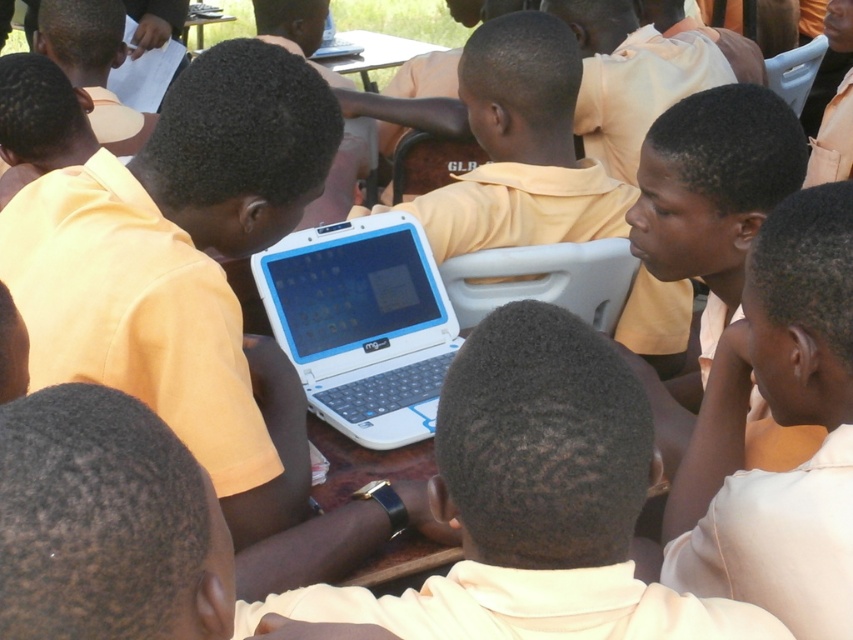
Question: Among these points, which one is nearest to the camera?

Choices:
 (A) (300, 234)
 (B) (337, 42)

Answer: (A)

Question: Is white plastic table at upper center bigger than white plastic laptop at upper center?

Choices:
 (A) no
 (B) yes

Answer: (B)

Question: Which object is closer to the camera taking this photo?

Choices:
 (A) white plastic table at upper center
 (B) white plastic laptop at upper center
 (C) matte yellow shirt at right

Answer: (C)

Question: Is white plastic laptop at center to the right of white plastic table at upper center from the viewer's perspective?

Choices:
 (A) yes
 (B) no

Answer: (A)

Question: Does white plastic laptop at center appear over white plastic laptop at upper center?

Choices:
 (A) yes
 (B) no

Answer: (B)

Question: Which of the following is the farthest from the observer?

Choices:
 (A) (364, 60)
 (B) (334, 29)
 (C) (769, 577)

Answer: (B)